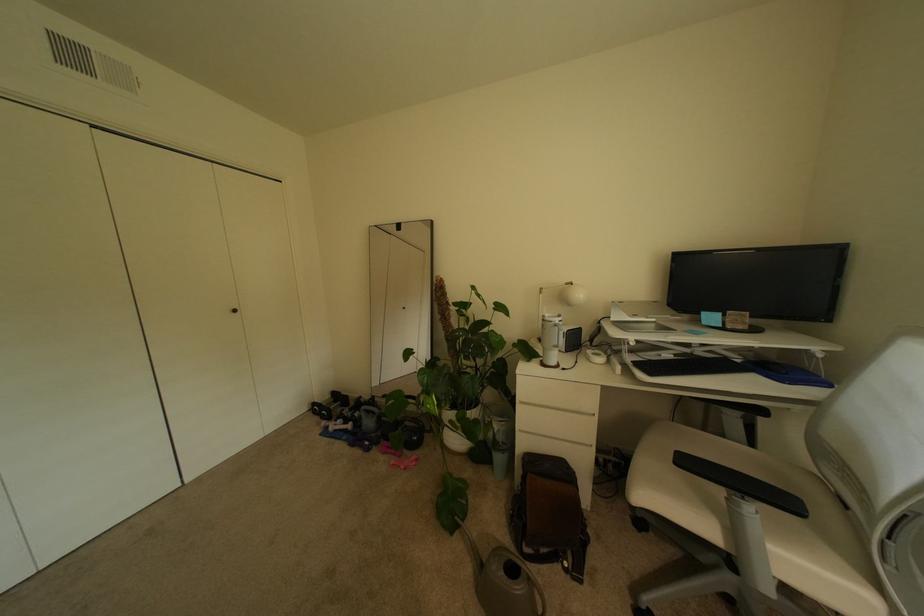
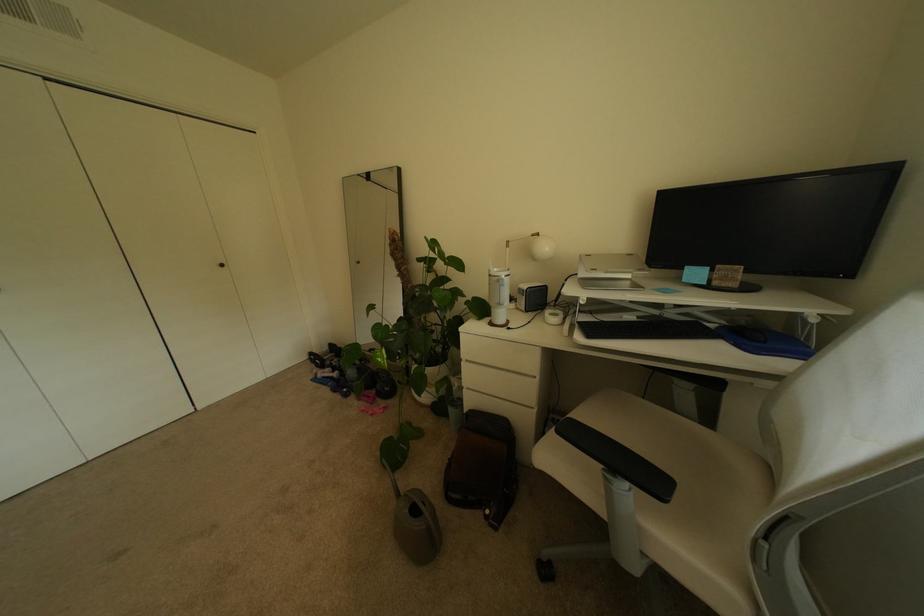
Locate, in the second image, the point that corresponds to (x=566, y=569) in the first image.

(488, 515)